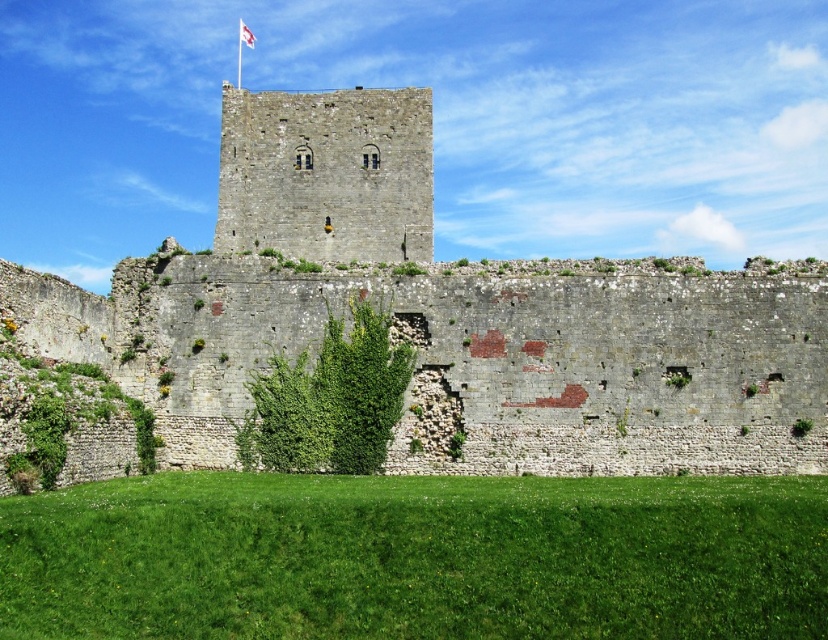
Question: From the image, what is the correct spatial relationship of gray stone tower at center in relation to white fabric flag at upper center?

Choices:
 (A) right
 (B) left

Answer: (A)

Question: Which of the following is the farthest from the observer?

Choices:
 (A) gray stone wall at center
 (B) white fabric flag at upper center

Answer: (B)

Question: Is gray stone wall at center further to the viewer compared to gray stone tower at center?

Choices:
 (A) yes
 (B) no

Answer: (B)

Question: Among these points, which one is nearest to the camera?

Choices:
 (A) (362, 246)
 (B) (241, 22)

Answer: (A)

Question: Does gray stone tower at center have a smaller size compared to white fabric flag at upper center?

Choices:
 (A) yes
 (B) no

Answer: (B)

Question: Which point appears closest to the camera in this image?

Choices:
 (A) (239, 20)
 (B) (307, 132)

Answer: (B)